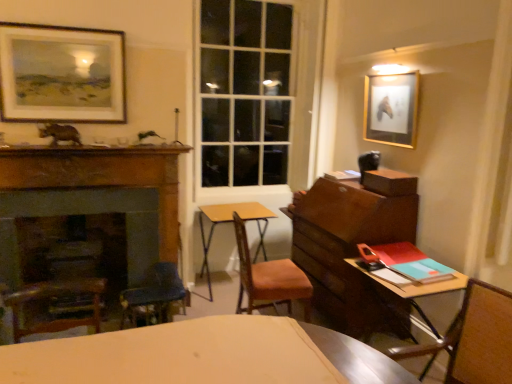
Question: In the image, is teal matte book at right positioned in front of or behind wooden fireplace at left?

Choices:
 (A) front
 (B) behind

Answer: (A)

Question: Based on their positions, is teal matte book at right located to the left or right of wooden fireplace at left?

Choices:
 (A) left
 (B) right

Answer: (B)

Question: Which is nearer to the wooden fireplace at left?

Choices:
 (A) teal matte book at right
 (B) wooden chair at center, the first chair positioned from the back
 (C) wooden desk at right, which ranks as the second table in left-to-right order
 (D) gold-framed picture at upper right, arranged as the first picture frame when viewed from the right
 (E) wooden chair at right, arranged as the first chair when viewed from the right

Answer: (B)

Question: Which object is the closest to the gold-framed picture at upper right, the second picture frame positioned from the left?

Choices:
 (A) matte black picture frame at upper left, marked as the 2th picture frame in a right-to-left arrangement
 (B) yellow wood table at center, the first table from the left
 (C) wooden fireplace at left
 (D) teal matte book at right
 (E) wooden chair at center, the first chair positioned from the back

Answer: (D)